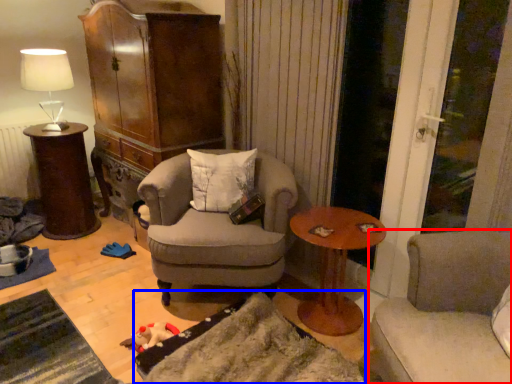
Question: Among these objects, which one is farthest to the camera, studio couch (highlighted by a red box) or wide (highlighted by a blue box)?

Choices:
 (A) studio couch
 (B) wide

Answer: (B)